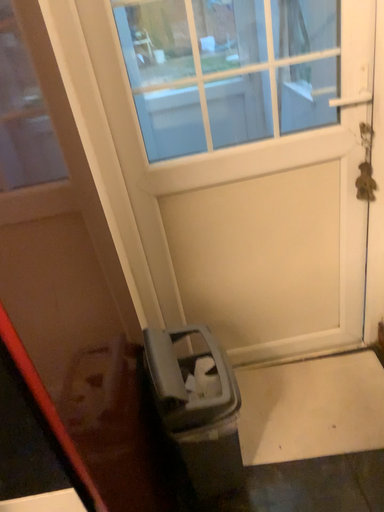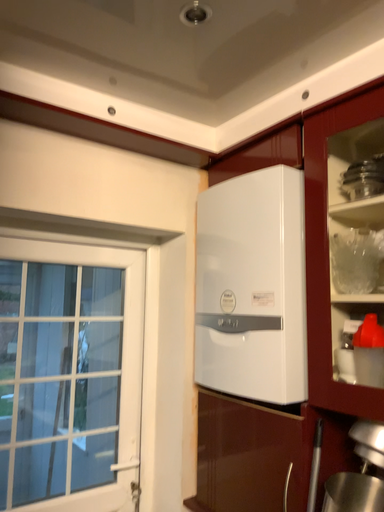
Question: Which way did the camera rotate in the video?

Choices:
 (A) rotated right
 (B) rotated left

Answer: (A)